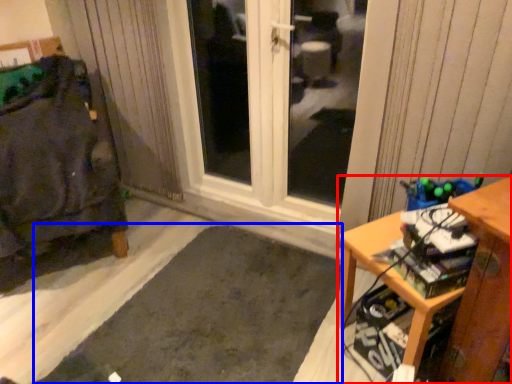
Question: Which point is further to the camera, desk (highlighted by a red box) or doormat (highlighted by a blue box)?

Choices:
 (A) desk
 (B) doormat

Answer: (A)